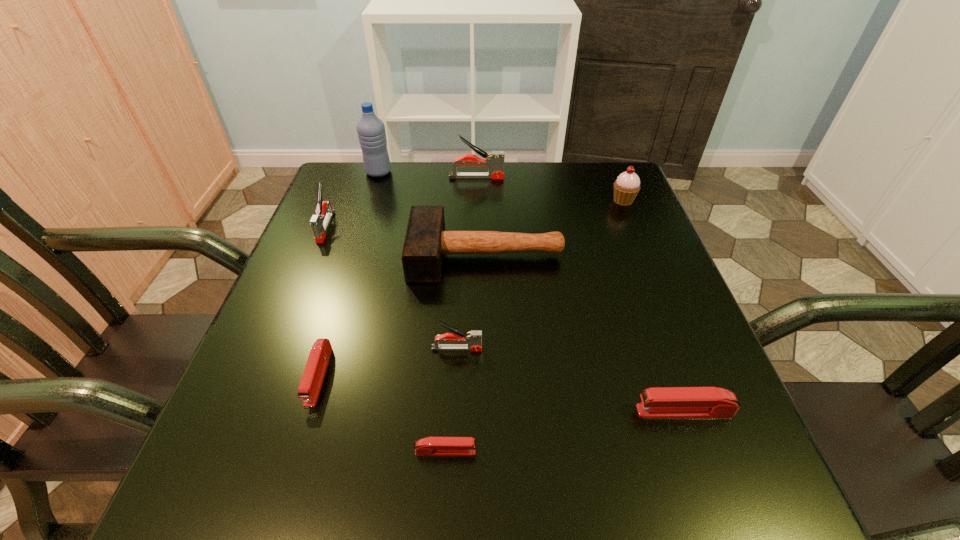
The image size is (960, 540). I want to click on free location at the right edge, so click(x=609, y=323).

Image resolution: width=960 pixels, height=540 pixels. Find the location of `free space at the far left corner of the desktop`. free space at the far left corner of the desktop is located at coordinates (368, 194).

Find the location of a particular element. The width and height of the screenshot is (960, 540). free location at the near left corner of the desktop is located at coordinates (213, 493).

Image resolution: width=960 pixels, height=540 pixels. Find the location of `vacant area at the far right corner of the desktop`. vacant area at the far right corner of the desktop is located at coordinates (x=598, y=185).

Where is `vacant region at the near right corner of the desktop`? The height and width of the screenshot is (540, 960). vacant region at the near right corner of the desktop is located at coordinates (708, 498).

Find the location of a particular element. This screenshot has width=960, height=540. vacant area that lies between the tallest object and the shortest stapler is located at coordinates (412, 312).

At what (x,y) coordinates should I click in order to perform the action: click on free space between the mallet and the rightmost stapler. Please return your answer as a coordinate pair (x, y). The width and height of the screenshot is (960, 540). Looking at the image, I should click on (585, 333).

At what (x,y) coordinates should I click in order to perform the action: click on vacant area between the blue water bottle and the eighth shortest object. Please return your answer as a coordinate pair (x, y). The height and width of the screenshot is (540, 960). Looking at the image, I should click on (427, 175).

This screenshot has height=540, width=960. In order to click on blank region between the nearest gray stapler and the mallet in this screenshot , I will do `click(471, 302)`.

You are a GUI agent. You are given a task and a screenshot of the screen. Output one action in this format:
    pyautogui.click(x=<x>, y=<y>)
    Task: Click on the free space between the tallest stapler and the fifth stapler from right to left
    The width and height of the screenshot is (960, 540).
    Given the screenshot: What is the action you would take?
    pyautogui.click(x=397, y=276)